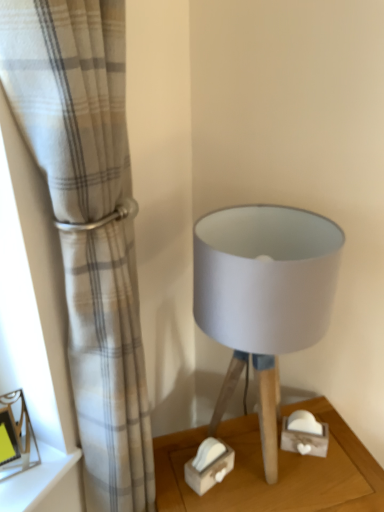
This screenshot has width=384, height=512. In order to click on vacant point to the left of wooden tissue box at lower center in this screenshot , I will do `click(170, 474)`.